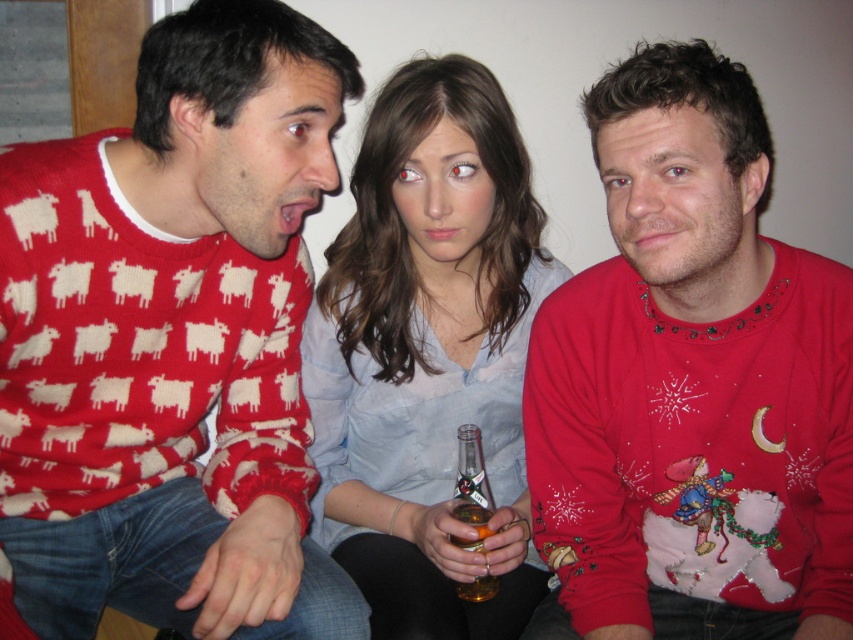
You are a photographer standing at a distance from the matte red sweater at left. You want to take a clear photo of it without any blur. According to the given information, what is the minimum distance you need to be from the sweater to achieve this?

The minimum distance you need to be from the matte red sweater at left is 31.48 inches, as this is the distance between the viewer and the sweater according to the description.

You are organizing a charity event and need to determine which item takes up more space between the matte red sweater at left and the translucent glass bottle at center. Which one requires more storage space?

The matte red sweater at left requires more storage space because it is larger in size than the translucent glass bottle at center.